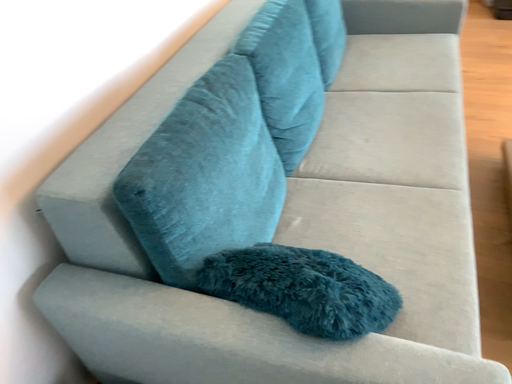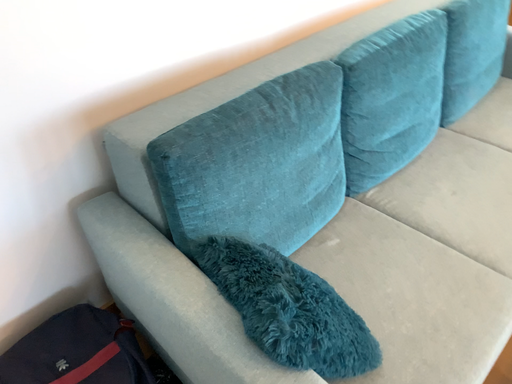
Question: How did the camera likely rotate when shooting the video?

Choices:
 (A) rotated left
 (B) rotated right

Answer: (A)